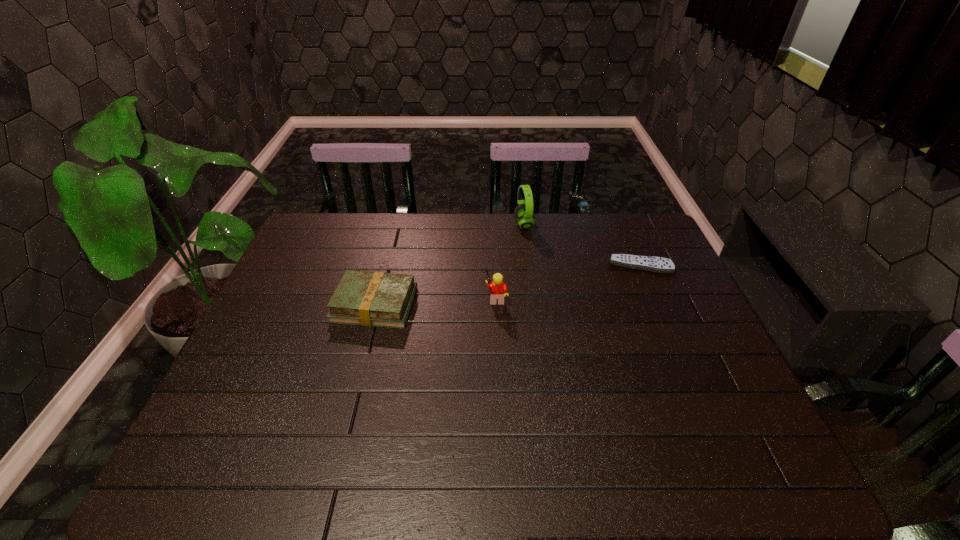
In the image, there is a desktop. Identify the location of vacant space at the far right corner. (630, 223).

Where is `vacant space that is in between the farthest object and the third object from right to left`? Image resolution: width=960 pixels, height=540 pixels. vacant space that is in between the farthest object and the third object from right to left is located at coordinates (510, 261).

Locate an element on the screen. This screenshot has width=960, height=540. free space that is in between the farthest object and the shortest object is located at coordinates (582, 245).

The height and width of the screenshot is (540, 960). Identify the location of vacant area that lies between the headset and the third nearest object. (582, 245).

Where is `vacant space that is in between the second shortest object and the tallest object`? This screenshot has height=540, width=960. vacant space that is in between the second shortest object and the tallest object is located at coordinates (449, 265).

Where is `free space between the second farthest object and the tallest object`? The width and height of the screenshot is (960, 540). free space between the second farthest object and the tallest object is located at coordinates (582, 245).

Where is `free area in between the third shortest object and the book`? The width and height of the screenshot is (960, 540). free area in between the third shortest object and the book is located at coordinates (436, 301).

Where is `free spot between the third object from left to right and the remote control`? free spot between the third object from left to right and the remote control is located at coordinates (582, 245).

Locate an element on the screen. vacant area that lies between the third shortest object and the third nearest object is located at coordinates (568, 282).

Identify the location of free space that is in between the second tallest object and the remote control. 568,282.